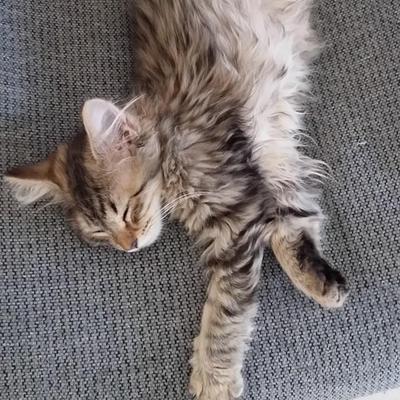
The width and height of the screenshot is (400, 400). I want to click on carpet or rug the cat is laying on, so click(100, 340).